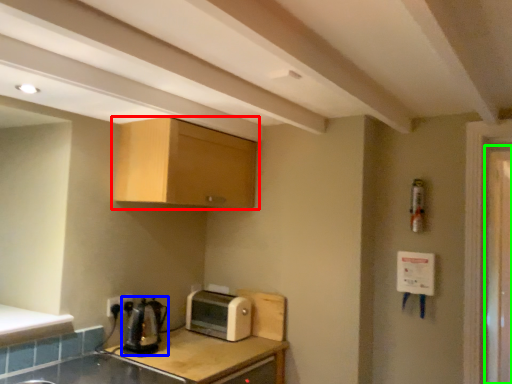
Question: Which object is positioned closest to cabinetry (highlighted by a red box)? Select from tea pot (highlighted by a blue box) and screen door (highlighted by a green box).

Choices:
 (A) tea pot
 (B) screen door

Answer: (A)